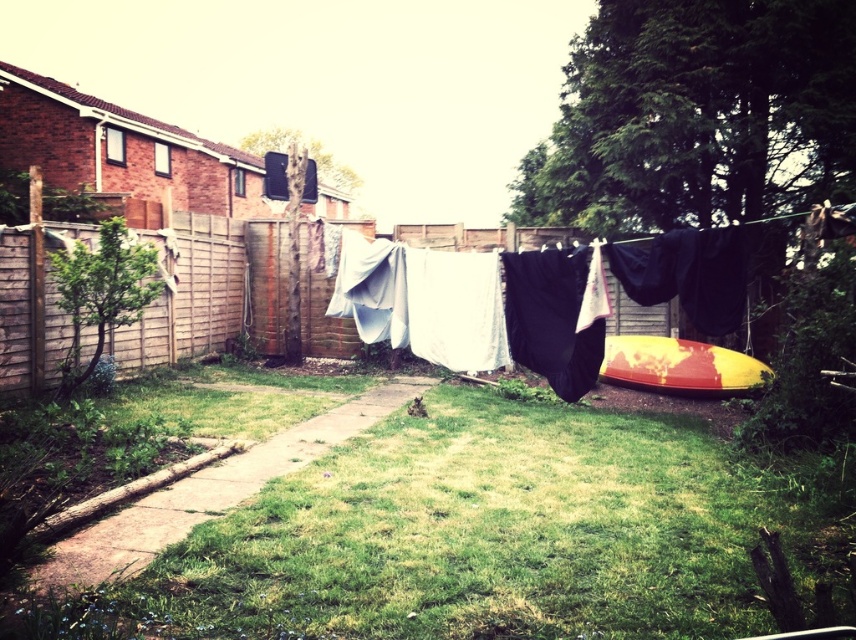
Question: Can you confirm if white fabric at center is wider than yellow and red painted canoe at right?

Choices:
 (A) no
 (B) yes

Answer: (B)

Question: Does green grass at center appear on the right side of white fabric at center?

Choices:
 (A) no
 (B) yes

Answer: (A)

Question: Which object appears farthest from the camera in this image?

Choices:
 (A) green grass at center
 (B) white fabric at center

Answer: (B)

Question: Can you confirm if green grass at center is bigger than white fabric at center?

Choices:
 (A) yes
 (B) no

Answer: (B)

Question: Which point appears farthest from the camera in this image?

Choices:
 (A) (235, 566)
 (B) (694, 230)

Answer: (B)

Question: Estimate the real-world distances between objects in this image. Which object is farther from the yellow and red painted canoe at right?

Choices:
 (A) green grass at center
 (B) white fabric at center

Answer: (A)